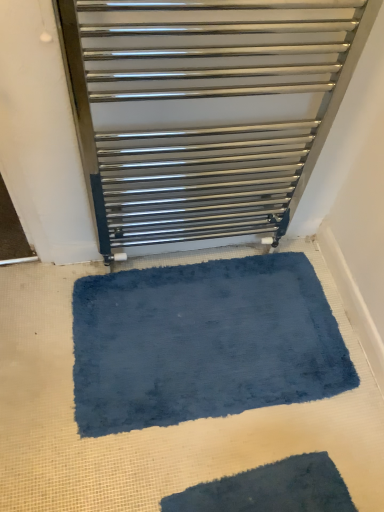
Question: Based on their sizes in the image, would you say blue plush bath mat at center, positioned as the second bath mat in bottom-to-top order, is bigger or smaller than dark blue shaggy bath mat at lower center, which ranks as the first bath mat in front-to-back order?

Choices:
 (A) big
 (B) small

Answer: (A)

Question: Considering the positions of blue plush bath mat at center, arranged as the 2th bath mat when viewed from the front, and dark blue shaggy bath mat at lower center, which appears as the second bath mat when viewed from the top, in the image, is blue plush bath mat at center, arranged as the 2th bath mat when viewed from the front, taller or shorter than dark blue shaggy bath mat at lower center, which appears as the second bath mat when viewed from the top,?

Choices:
 (A) short
 (B) tall

Answer: (B)

Question: Which object is the closest to the dark blue shaggy bath mat at lower center, positioned as the second bath mat in back-to-front order?

Choices:
 (A) satin silver towel rail at upper center
 (B) blue plush bath mat at center, positioned as the second bath mat in bottom-to-top order

Answer: (B)

Question: Estimate the real-world distances between objects in this image. Which object is closer to the satin silver towel rail at upper center?

Choices:
 (A) dark blue shaggy bath mat at lower center, which ranks as the first bath mat in front-to-back order
 (B) blue plush bath mat at center, positioned as the second bath mat in bottom-to-top order

Answer: (B)